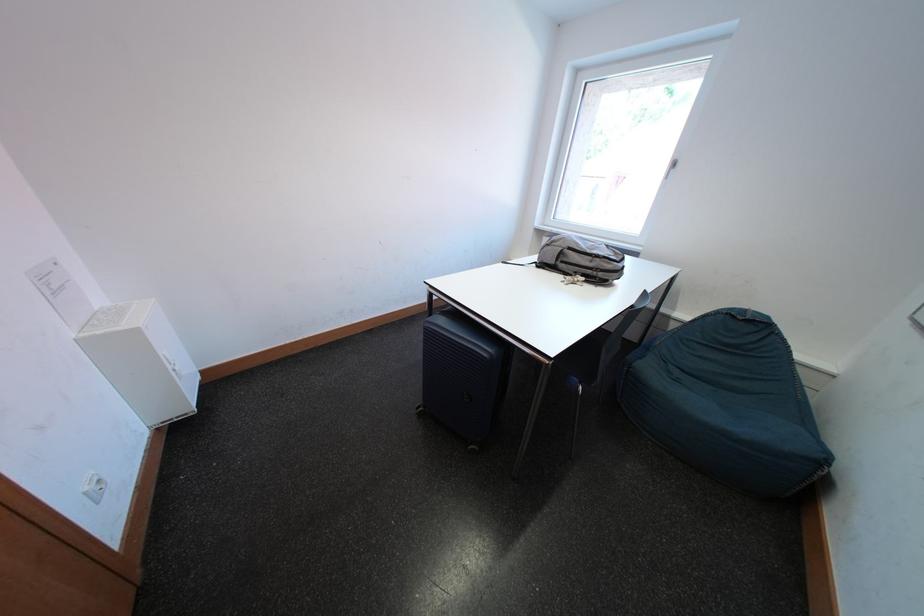
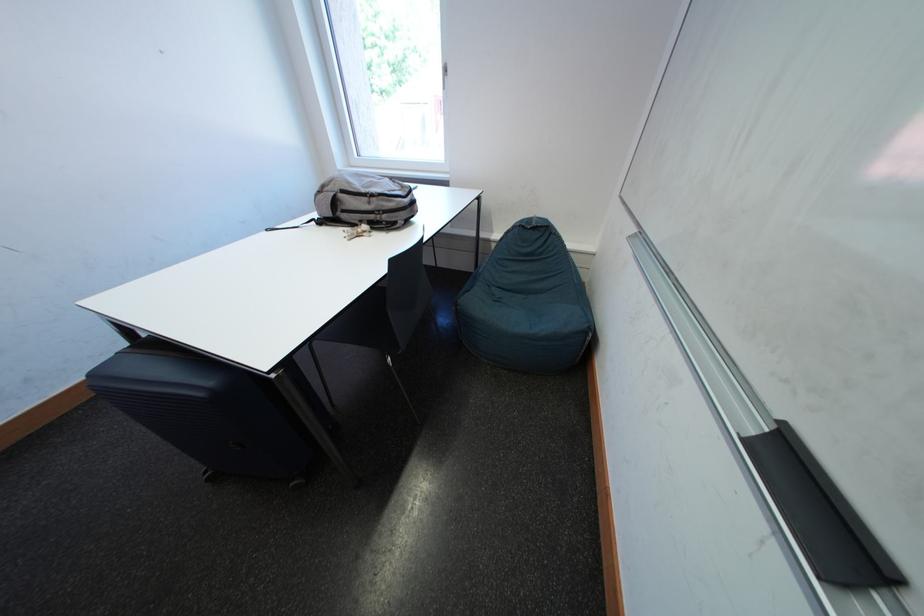
Where in the second image is the point corresponding to point 600,261 from the first image?

(375, 203)